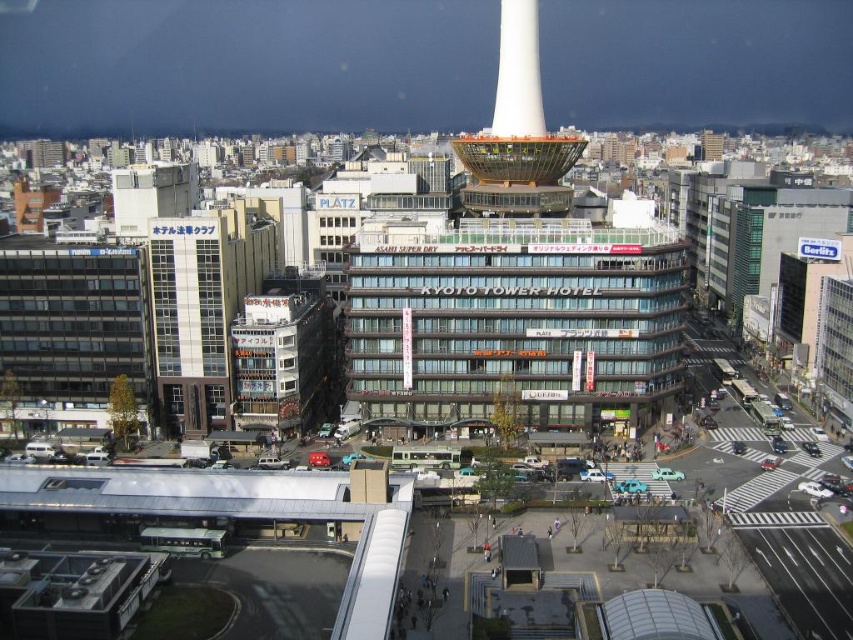
You are standing in the bustling urban scene of Kyoto Tower Hotel. You notice two points marked in the image. The first point is at coordinates (178, 381) and the second point is at (585, 141). Which point is nearer to you?

Point (178, 381) is closer to the viewer than point (585, 141).

You are a drone operator who needs to fly a drone from the white glass building at left to the white glossy tower at center. Given that the drone has a maximum flight range of 50 meters, will it be able to reach the tower without needing to recharge?

The white glass building at left and white glossy tower at center are 46.71 meters apart from each other. Since the drone has a maximum flight range of 50 meters, it can reach the tower without needing to recharge as the distance is within its range.